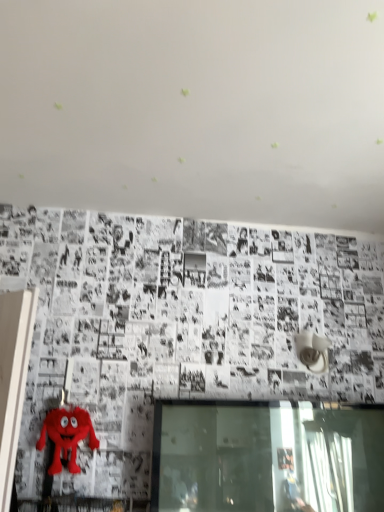
Question: From their relative heights in the image, would you say transparent glass window at lower center is taller or shorter than fuzzy red plush toy at lower left?

Choices:
 (A) short
 (B) tall

Answer: (B)

Question: From the image's perspective, is transparent glass window at lower center positioned above or below fuzzy red plush toy at lower left?

Choices:
 (A) below
 (B) above

Answer: (A)

Question: Is transparent glass window at lower center inside or outside of fuzzy red plush toy at lower left?

Choices:
 (A) outside
 (B) inside

Answer: (A)

Question: Considering their positions, is fuzzy red plush toy at lower left located in front of or behind transparent glass window at lower center?

Choices:
 (A) front
 (B) behind

Answer: (B)

Question: Is point (62, 423) positioned closer to the camera than point (188, 420)?

Choices:
 (A) farther
 (B) closer

Answer: (A)

Question: From their relative heights in the image, would you say fuzzy red plush toy at lower left is taller or shorter than transparent glass window at lower center?

Choices:
 (A) tall
 (B) short

Answer: (B)

Question: Is fuzzy red plush toy at lower left situated inside transparent glass window at lower center or outside?

Choices:
 (A) inside
 (B) outside

Answer: (B)